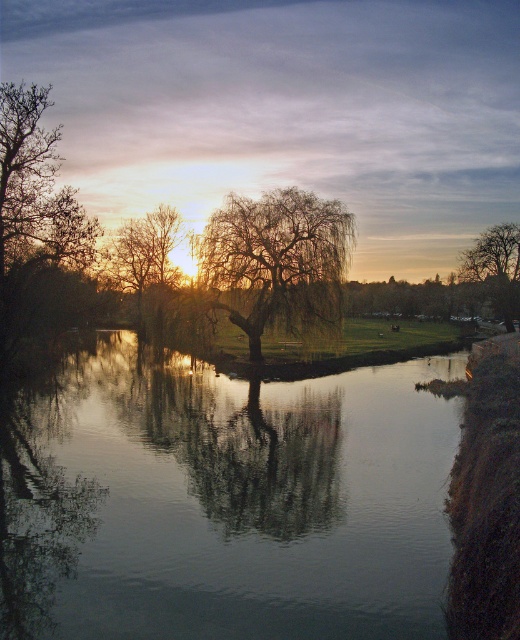
You are standing on the bank of the river and see the willow tree at center and the brown rough tree at right. Which tree has a wider trunk?

The brown rough tree at right has a wider trunk than the willow tree at center.

You are standing on the bank of the lake and see the transparent water at center and the bare branches at center. Which object is closer to your right side?

The transparent water at center is to the right of bare branches at center, so the transparent water at center is closer to your right side.